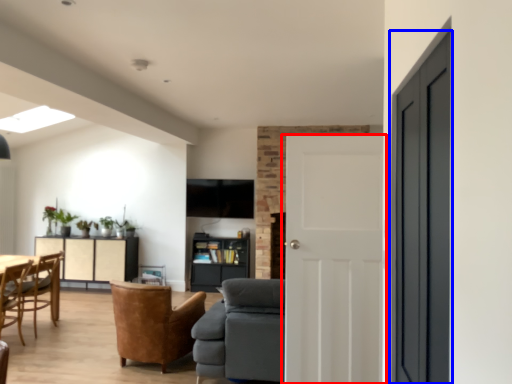
Question: Which point is closer to the camera, door (highlighted by a red box) or door (highlighted by a blue box)?

Choices:
 (A) door
 (B) door

Answer: (B)